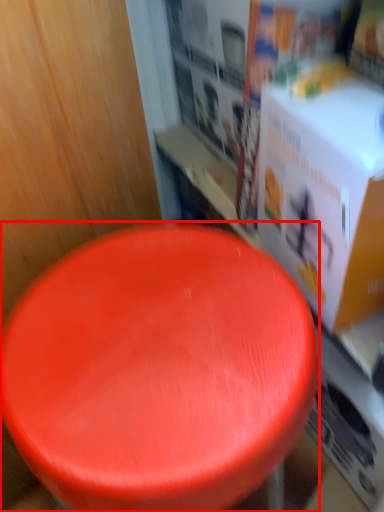
Question: From the image's perspective, considering the relative positions of stool (annotated by the red box) and box in the image provided, where is stool (annotated by the red box) located with respect to the staircase?

Choices:
 (A) below
 (B) above

Answer: (A)